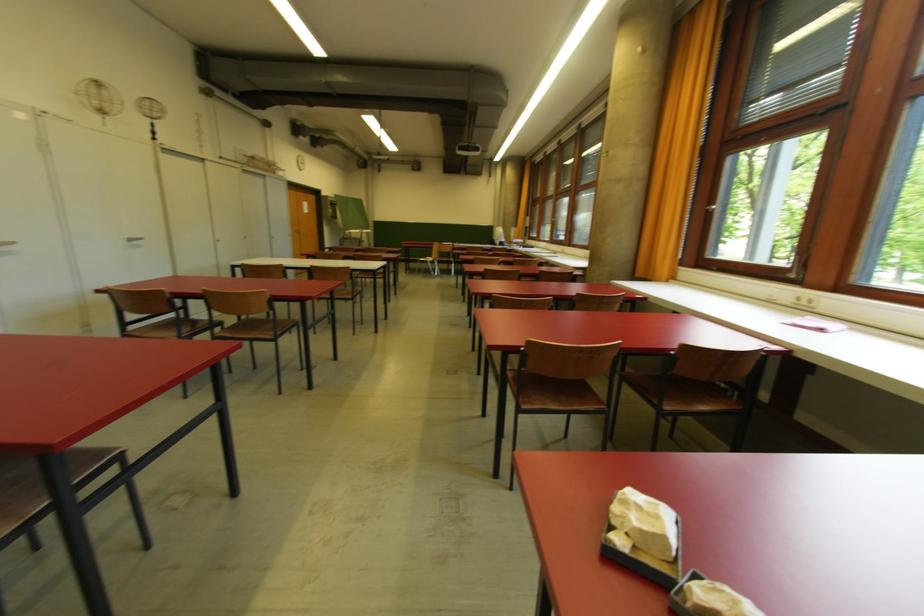
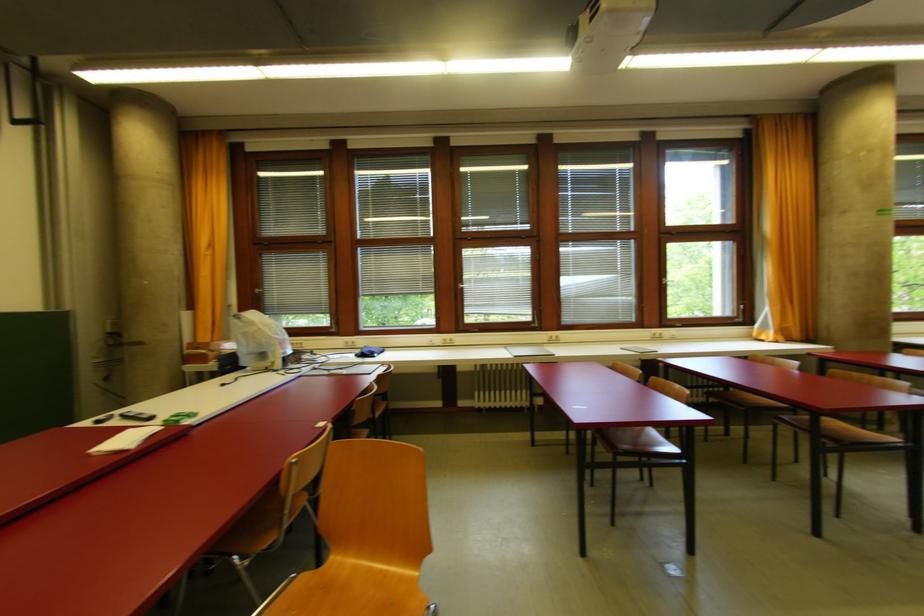
The point at (555, 222) is marked in the first image. Where is the corresponding point in the second image?

(465, 288)